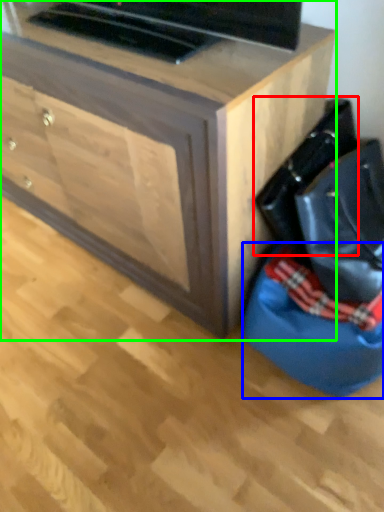
Question: Considering the real-world distances, which object is closest to messenger bag (highlighted by a red box)? bean bag chair (highlighted by a blue box) or chest of drawers (highlighted by a green box).

Choices:
 (A) bean bag chair
 (B) chest of drawers

Answer: (A)